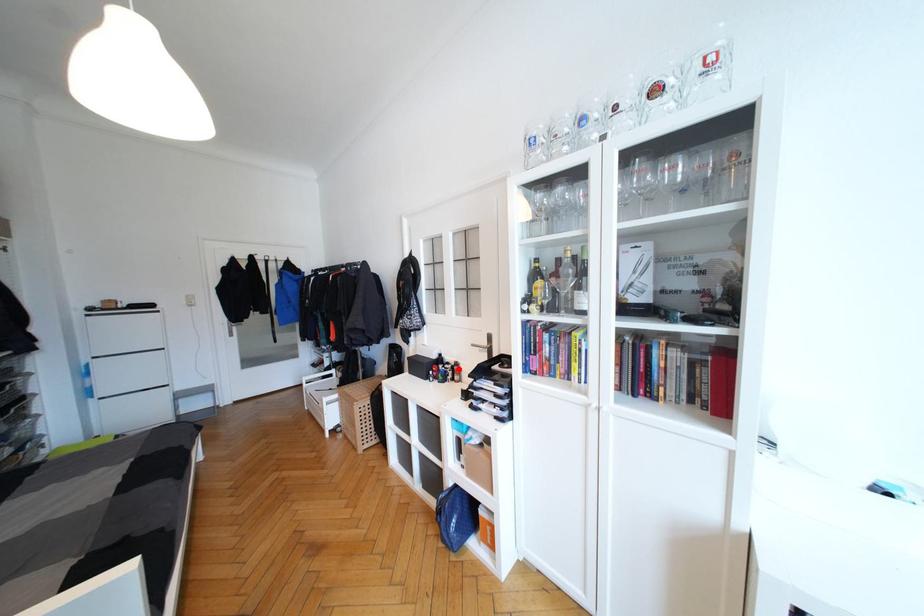
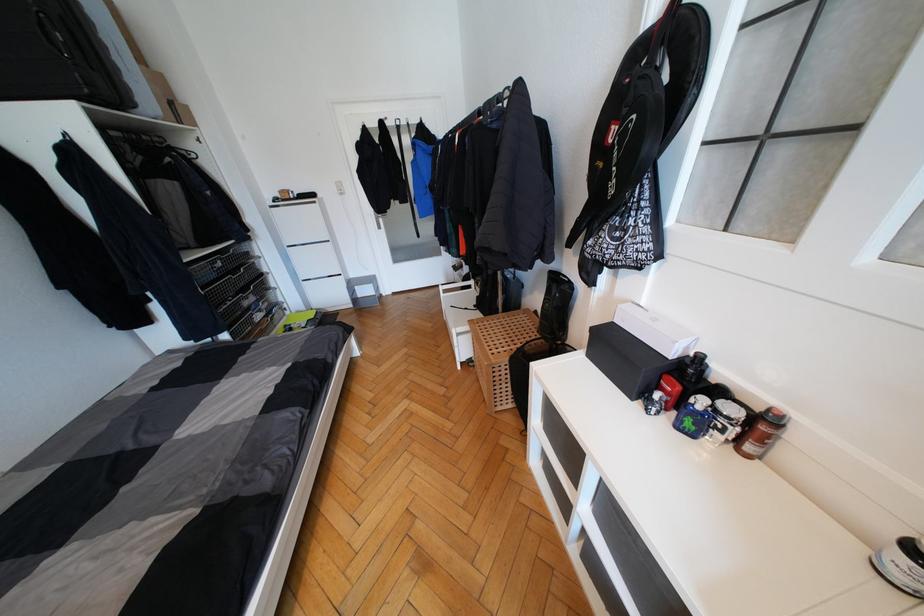
Locate, in the second image, the point that corresponds to the highlighted location in the first image.

(767, 429)